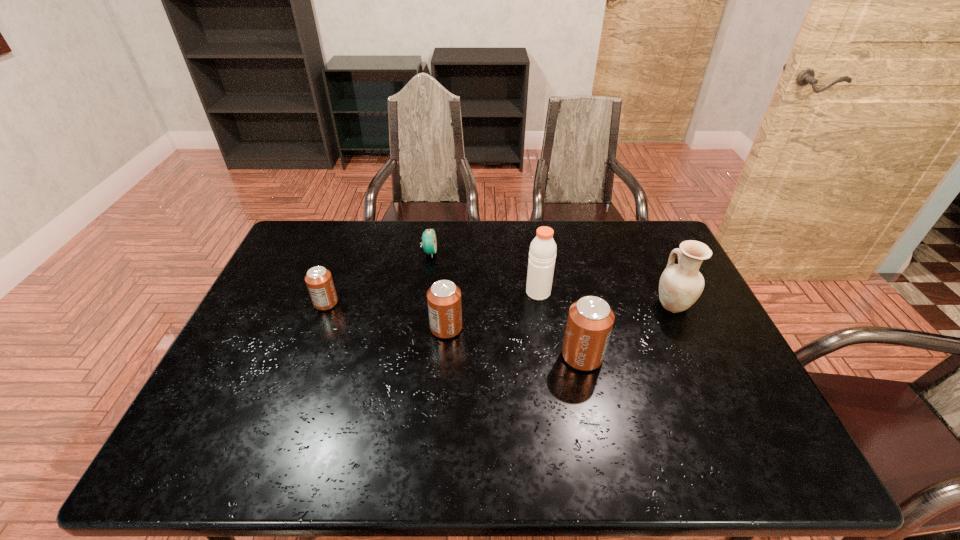
Observe the arrangement of all cans in the image. To keep them evenly spaced, where would you place another can on the right? Please locate a free space. Please provide its 2D coordinates. Your answer should be formatted as a tuple, i.e. [(x, y)], where the tuple contains the x and y coordinates of a point satisfying the conditions above.

[(737, 388)]